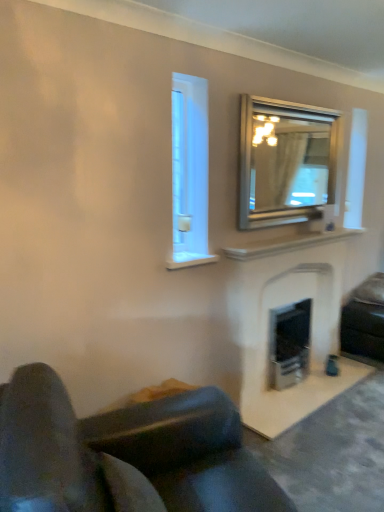
The height and width of the screenshot is (512, 384). I want to click on leather couch at lower left, the 1th studio couch when ordered from front to back, so click(x=126, y=454).

Locate an element on the screen. white stone fireplace at center is located at coordinates (273, 325).

I want to click on black leather studio couch at lower right, which is the 2th studio couch in front-to-back order, so click(x=364, y=320).

Is white marble fireplace at upper center facing towards black leather studio couch at lower right, which is the 1th studio couch from back to front?

No, white marble fireplace at upper center is not turned towards black leather studio couch at lower right, which is the 1th studio couch from back to front.

The height and width of the screenshot is (512, 384). In order to click on the 2nd studio couch below the white marble fireplace at upper center (from a real-world perspective) in this screenshot , I will do `click(364, 320)`.

Between point (330, 238) and point (368, 351), which one is positioned behind?

The point (368, 351) is behind.

Which is more to the left, leather couch at lower left, positioned as the second studio couch in back-to-front order, or black leather studio couch at lower right, acting as the first studio couch starting from the right?

leather couch at lower left, positioned as the second studio couch in back-to-front order.

Which object is wider, leather couch at lower left, acting as the first studio couch starting from the left, or black leather studio couch at lower right, the second studio couch from the left?

Wider between the two is leather couch at lower left, acting as the first studio couch starting from the left.

What's the angular difference between leather couch at lower left, the 1th studio couch when ordered from front to back, and black leather studio couch at lower right, acting as the first studio couch starting from the right,'s facing directions?

leather couch at lower left, the 1th studio couch when ordered from front to back, and black leather studio couch at lower right, acting as the first studio couch starting from the right, are facing 65.5 degrees away from each other.

From the image's perspective, which object appears higher, leather couch at lower left, the 1th studio couch when ordered from front to back, or black leather studio couch at lower right, which is the 2th studio couch in front-to-back order?

black leather studio couch at lower right, which is the 2th studio couch in front-to-back order, appears higher in the image.

Consider the image. What's the angular difference between black leather studio couch at lower right, the second studio couch from the left, and silver metallic mirror at upper right's facing directions?

black leather studio couch at lower right, the second studio couch from the left, and silver metallic mirror at upper right are facing 0.304 degrees away from each other.

Is black leather studio couch at lower right, the second studio couch from the left, smaller than silver metallic mirror at upper right?

No.

Is black leather studio couch at lower right, which is the 2th studio couch in front-to-back order, spatially inside silver metallic mirror at upper right, or outside of it?

black leather studio couch at lower right, which is the 2th studio couch in front-to-back order, is spatially situated outside silver metallic mirror at upper right.

From a real-world perspective, which object rests below the other?

black leather studio couch at lower right, which is the 1th studio couch from back to front, from a real-world perspective.

Where is `studio couch lying in front of the silver metallic mirror at upper right`? The width and height of the screenshot is (384, 512). studio couch lying in front of the silver metallic mirror at upper right is located at coordinates (126, 454).

Is leather couch at lower left, positioned as the second studio couch in back-to-front order, aimed at silver metallic mirror at upper right?

No, leather couch at lower left, positioned as the second studio couch in back-to-front order, is not oriented towards silver metallic mirror at upper right.

Would you say leather couch at lower left, marked as the 2th studio couch in a right-to-left arrangement, is outside silver metallic mirror at upper right?

Absolutely, leather couch at lower left, marked as the 2th studio couch in a right-to-left arrangement, is external to silver metallic mirror at upper right.

Would you say leather couch at lower left, acting as the first studio couch starting from the left, is to the left or to the right of silver metallic mirror at upper right in the picture?

leather couch at lower left, acting as the first studio couch starting from the left, is to the left of silver metallic mirror at upper right.

Is silver metallic mirror at upper right facing towards white marble fireplace at upper center?

No, silver metallic mirror at upper right is not turned towards white marble fireplace at upper center.

From the picture: Measure the distance between silver metallic mirror at upper right and white marble fireplace at upper center.

The distance of silver metallic mirror at upper right from white marble fireplace at upper center is 17.87 inches.

Does silver metallic mirror at upper right have a lesser width compared to white marble fireplace at upper center?

Indeed, silver metallic mirror at upper right has a lesser width compared to white marble fireplace at upper center.

Based on the photo, from a real-world perspective, which object rests below the other?

black leather studio couch at lower right, which is the 2th studio couch in front-to-back order, is physically lower.

Considering the positions of objects black leather studio couch at lower right, which is the 2th studio couch in front-to-back order, and leather couch at lower left, the 1th studio couch when ordered from front to back, in the image provided, who is more to the left, black leather studio couch at lower right, which is the 2th studio couch in front-to-back order, or leather couch at lower left, the 1th studio couch when ordered from front to back,?

leather couch at lower left, the 1th studio couch when ordered from front to back.

From the image's perspective, is black leather studio couch at lower right, acting as the first studio couch starting from the right, under leather couch at lower left, positioned as the second studio couch in back-to-front order?

No, from the image's perspective, black leather studio couch at lower right, acting as the first studio couch starting from the right, is not below leather couch at lower left, positioned as the second studio couch in back-to-front order.

Does black leather studio couch at lower right, the second studio couch from the left, have a smaller size compared to leather couch at lower left, positioned as the second studio couch in back-to-front order?

Yes.

This screenshot has height=512, width=384. In order to click on mirror above the leather couch at lower left, the 1th studio couch when ordered from front to back (from the image's perspective) in this screenshot , I will do 285,162.

Which of these two, silver metallic mirror at upper right or leather couch at lower left, positioned as the second studio couch in back-to-front order, stands taller?

leather couch at lower left, positioned as the second studio couch in back-to-front order.

Considering the relative sizes of silver metallic mirror at upper right and leather couch at lower left, the 1th studio couch when ordered from front to back, in the image provided, is silver metallic mirror at upper right wider than leather couch at lower left, the 1th studio couch when ordered from front to back,?

No.

From a real-world perspective, count 2nd studio couchs downward from the white marble fireplace at upper center and point to it. Please provide its 2D coordinates.

[(364, 320)]

Locate an element on the screen. studio couch on the right of leather couch at lower left, the 1th studio couch when ordered from front to back is located at coordinates (364, 320).

Which object lies nearer to the anchor point leather couch at lower left, acting as the first studio couch starting from the left, black leather studio couch at lower right, which is the 2th studio couch in front-to-back order, or silver metallic mirror at upper right?

Among the two, silver metallic mirror at upper right is located nearer to leather couch at lower left, acting as the first studio couch starting from the left.

When comparing their distances from white stone fireplace at center, does black leather studio couch at lower right, acting as the first studio couch starting from the right, or leather couch at lower left, marked as the 2th studio couch in a right-to-left arrangement, seem closer?

black leather studio couch at lower right, acting as the first studio couch starting from the right, is positioned closer to the anchor white stone fireplace at center.

In the scene shown: Considering their positions, is silver metallic mirror at upper right positioned closer to leather couch at lower left, the 1th studio couch when ordered from front to back, than black leather studio couch at lower right, which is the 1th studio couch from back to front?

Based on the image, silver metallic mirror at upper right appears to be nearer to leather couch at lower left, the 1th studio couch when ordered from front to back.

Considering their positions, is leather couch at lower left, the 1th studio couch when ordered from front to back, positioned further to black leather studio couch at lower right, which is the 2th studio couch in front-to-back order, than white stone fireplace at center?

leather couch at lower left, the 1th studio couch when ordered from front to back, is positioned further to the anchor black leather studio couch at lower right, which is the 2th studio couch in front-to-back order.

Looking at the image, which one is located further to leather couch at lower left, acting as the first studio couch starting from the left, white stone fireplace at center or silver metallic mirror at upper right?

silver metallic mirror at upper right lies further to leather couch at lower left, acting as the first studio couch starting from the left, than the other object.

Looking at the image, which one is located further to white marble fireplace at upper center, silver metallic mirror at upper right or leather couch at lower left, acting as the first studio couch starting from the left?

leather couch at lower left, acting as the first studio couch starting from the left, is positioned further to the anchor white marble fireplace at upper center.

When comparing their distances from white stone fireplace at center, does white marble fireplace at upper center or black leather studio couch at lower right, acting as the first studio couch starting from the right, seem further?

The object further to white stone fireplace at center is black leather studio couch at lower right, acting as the first studio couch starting from the right.

Which object lies nearer to the anchor point white stone fireplace at center, white marble fireplace at upper center or silver metallic mirror at upper right?

Among the two, white marble fireplace at upper center is located nearer to white stone fireplace at center.

This screenshot has width=384, height=512. Identify the location of mantle that lies between silver metallic mirror at upper right and white stone fireplace at center from top to bottom. (286, 244).

Where is `mantle between silver metallic mirror at upper right and black leather studio couch at lower right, which is the 2th studio couch in front-to-back order, from top to bottom`? mantle between silver metallic mirror at upper right and black leather studio couch at lower right, which is the 2th studio couch in front-to-back order, from top to bottom is located at coordinates (286, 244).

Identify the location of mirror between leather couch at lower left, positioned as the second studio couch in back-to-front order, and white marble fireplace at upper center in the front-back direction. The height and width of the screenshot is (512, 384). (285, 162).

Identify the location of fireplace that lies between silver metallic mirror at upper right and black leather studio couch at lower right, acting as the first studio couch starting from the right, from top to bottom. This screenshot has height=512, width=384. (273, 325).